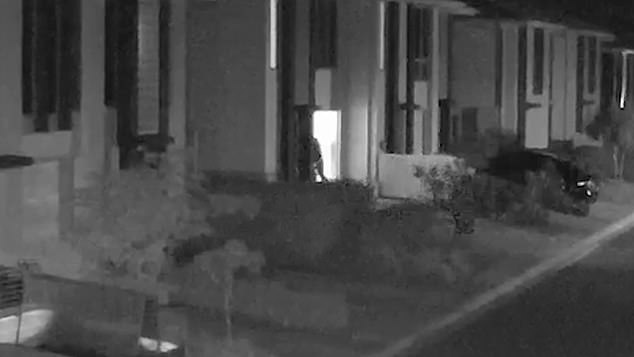
Identify the location of doorway. The image size is (634, 357). tap(324, 135).